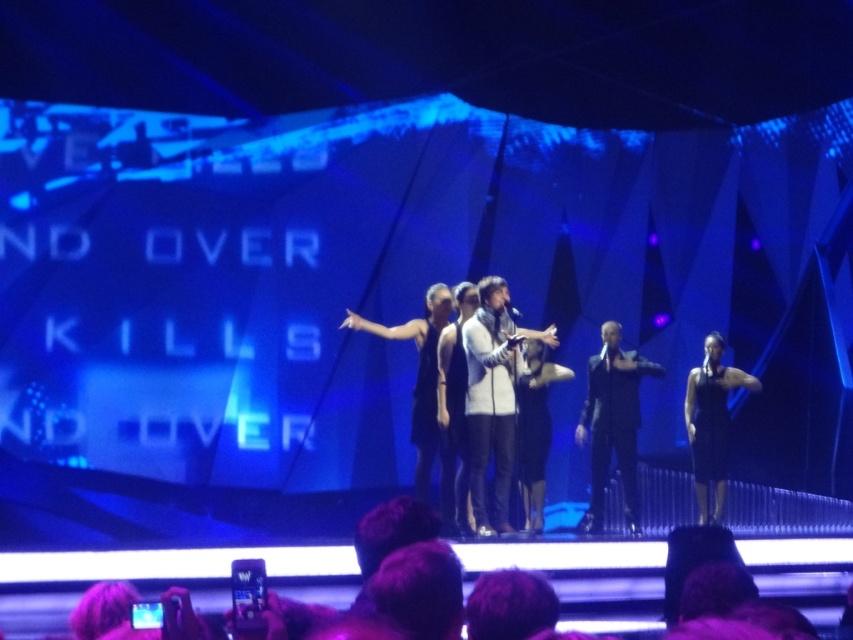
Can you confirm if black leather suit at center is wider than black satin dress at center?

Yes, black leather suit at center is wider than black satin dress at center.

Which is above, black leather suit at center or black satin dress at center?

black leather suit at center is above.

Who is more forward, [610,380] or [701,369]?

Positioned in front is point [610,380].

Locate an element on the screen. The height and width of the screenshot is (640, 853). black leather suit at center is located at coordinates (612, 424).